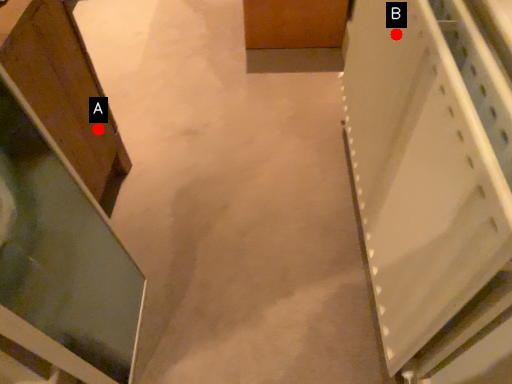
Question: Two points are circled on the image, labeled by A and B beside each circle. Which of the following is the closest to the observer?

Choices:
 (A) A is closer
 (B) B is closer

Answer: (B)